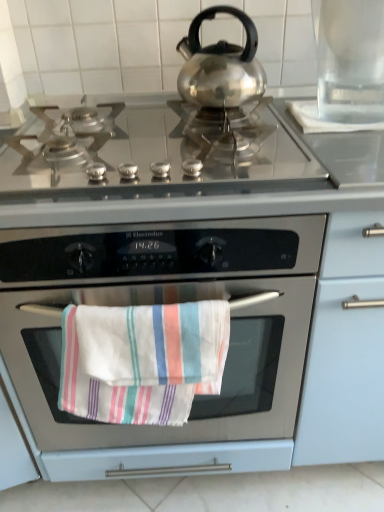
Question: Considering the relative sizes of transparent glass pitcher at upper right and stainless steel oven at center in the image provided, is transparent glass pitcher at upper right wider than stainless steel oven at center?

Choices:
 (A) no
 (B) yes

Answer: (A)

Question: Is the depth of transparent glass pitcher at upper right greater than that of stainless steel oven at center?

Choices:
 (A) yes
 (B) no

Answer: (A)

Question: Is transparent glass pitcher at upper right with stainless steel oven at center?

Choices:
 (A) yes
 (B) no

Answer: (B)

Question: Does transparent glass pitcher at upper right have a lesser height compared to stainless steel oven at center?

Choices:
 (A) no
 (B) yes

Answer: (B)

Question: From the image's perspective, would you say transparent glass pitcher at upper right is shown under stainless steel oven at center?

Choices:
 (A) no
 (B) yes

Answer: (A)

Question: From the image's perspective, is white striped towel at center above or below transparent glass pitcher at upper right?

Choices:
 (A) above
 (B) below

Answer: (B)

Question: Considering the positions of white striped towel at center and transparent glass pitcher at upper right in the image, is white striped towel at center wider or thinner than transparent glass pitcher at upper right?

Choices:
 (A) wide
 (B) thin

Answer: (B)

Question: Would you say white striped towel at center is inside or outside transparent glass pitcher at upper right?

Choices:
 (A) inside
 (B) outside

Answer: (B)

Question: From a real-world perspective, relative to transparent glass pitcher at upper right, is white striped towel at center vertically above or below?

Choices:
 (A) above
 (B) below

Answer: (B)

Question: In terms of size, does stainless steel cooktop at center appear bigger or smaller than stainless steel oven at center?

Choices:
 (A) small
 (B) big

Answer: (A)

Question: From a real-world perspective, is stainless steel cooktop at center physically located above or below stainless steel oven at center?

Choices:
 (A) below
 (B) above

Answer: (B)

Question: Is point (61, 154) closer or farther from the camera than point (236, 325)?

Choices:
 (A) farther
 (B) closer

Answer: (B)

Question: Considering the positions of stainless steel cooktop at center and stainless steel oven at center in the image, is stainless steel cooktop at center wider or thinner than stainless steel oven at center?

Choices:
 (A) thin
 (B) wide

Answer: (A)

Question: In terms of height, does stainless steel oven at center look taller or shorter compared to transparent glass pitcher at upper right?

Choices:
 (A) tall
 (B) short

Answer: (A)

Question: Visually, is stainless steel oven at center positioned to the left or to the right of transparent glass pitcher at upper right?

Choices:
 (A) left
 (B) right

Answer: (A)